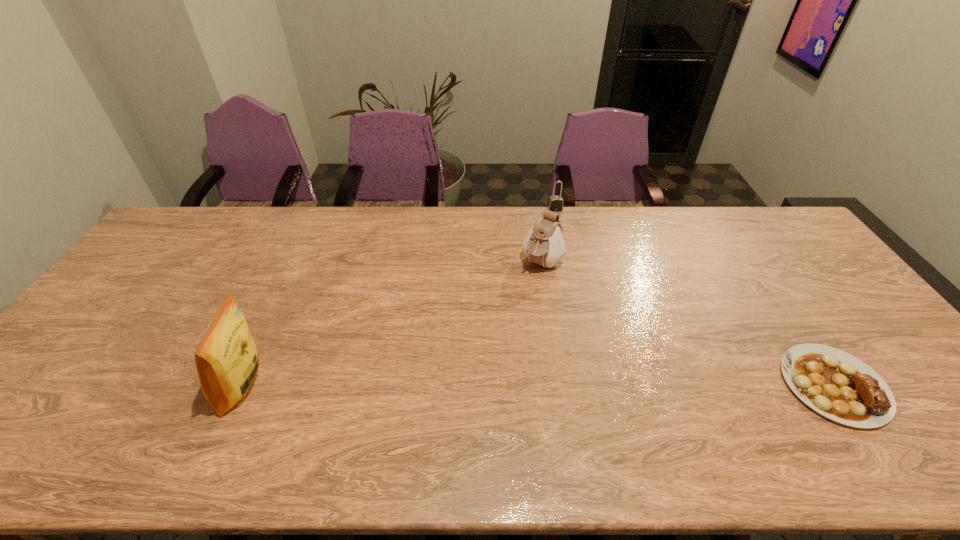
Where is `the tallest object`? The height and width of the screenshot is (540, 960). the tallest object is located at coordinates (227, 360).

Find the location of a particular element. This screenshot has height=540, width=960. crisp (potato chip) is located at coordinates (227, 360).

Identify the location of the shortest object. (837, 385).

This screenshot has width=960, height=540. Identify the location of steak. (837, 385).

Identify the location of the second farthest object. This screenshot has width=960, height=540. (544, 244).

At what (x,y) coordinates should I click in order to perform the action: click on pouch. Please return your answer as a coordinate pair (x, y). This screenshot has width=960, height=540. Looking at the image, I should click on (544, 244).

The width and height of the screenshot is (960, 540). Find the location of `padlock`. padlock is located at coordinates (555, 203).

You are a GUI agent. You are given a task and a screenshot of the screen. Output one action in this format:
    pyautogui.click(x=<x>, y=<y>)
    Task: Click on the third tallest object
    This screenshot has height=540, width=960.
    Given the screenshot: What is the action you would take?
    pyautogui.click(x=555, y=203)

Where is `free space located on the front-facing side of the tallest object`? free space located on the front-facing side of the tallest object is located at coordinates (95, 386).

The width and height of the screenshot is (960, 540). What are the coordinates of `vacant space positioned on the front-facing side of the tallest object` in the screenshot? It's located at (177, 386).